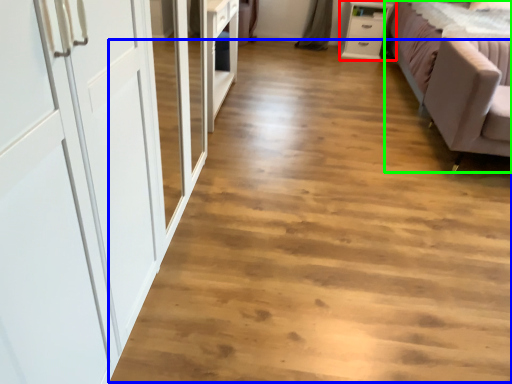
Question: Estimate the real-world distances between objects in this image. Which object is closer to chest of drawers (highlighted by a red box), plain (highlighted by a blue box) or studio couch (highlighted by a green box)?

Choices:
 (A) plain
 (B) studio couch

Answer: (B)